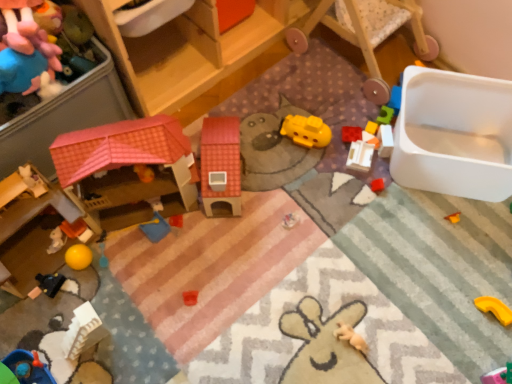
The image size is (512, 384). I want to click on free region on the left part of black matte toy car at lower left, the tenth toy viewed from the right, so click(17, 283).